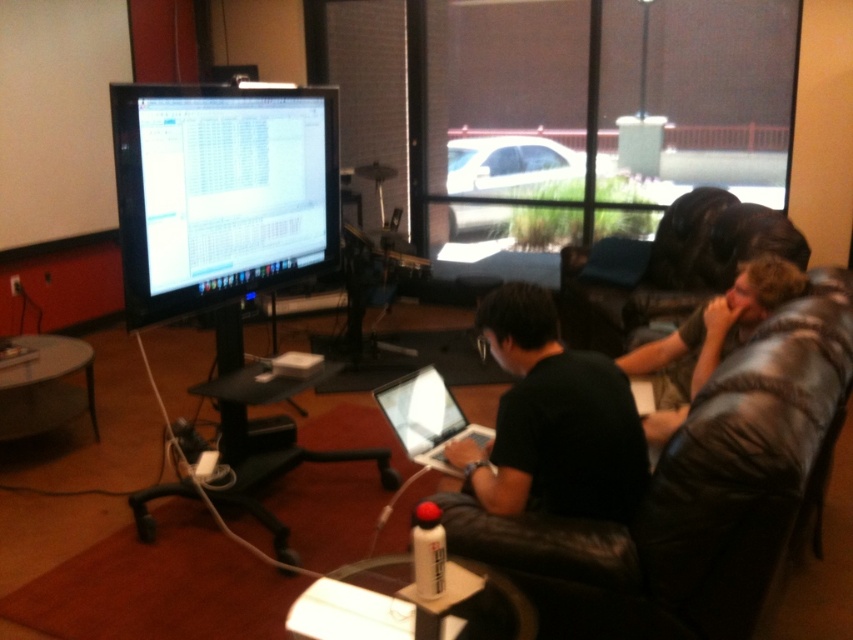
Question: Which point appears closest to the camera in this image?

Choices:
 (A) (421, 376)
 (B) (277, 138)
 (C) (730, 332)

Answer: (C)

Question: Can you confirm if black glossy monitor at upper left is thinner than silver metallic laptop at center?

Choices:
 (A) no
 (B) yes

Answer: (A)

Question: Among these objects, which one is farthest from the camera?

Choices:
 (A) silver metallic laptop at center
 (B) black matte laptop at center
 (C) black leather couch at center

Answer: (A)

Question: Which of the following is the farthest from the observer?

Choices:
 (A) black matte laptop at center
 (B) dark brown leather couch at right

Answer: (B)

Question: In this image, where is black glossy monitor at upper left located relative to black matte laptop at center?

Choices:
 (A) above
 (B) below

Answer: (A)

Question: Is black leather couch at center in front of black matte laptop at center?

Choices:
 (A) no
 (B) yes

Answer: (B)